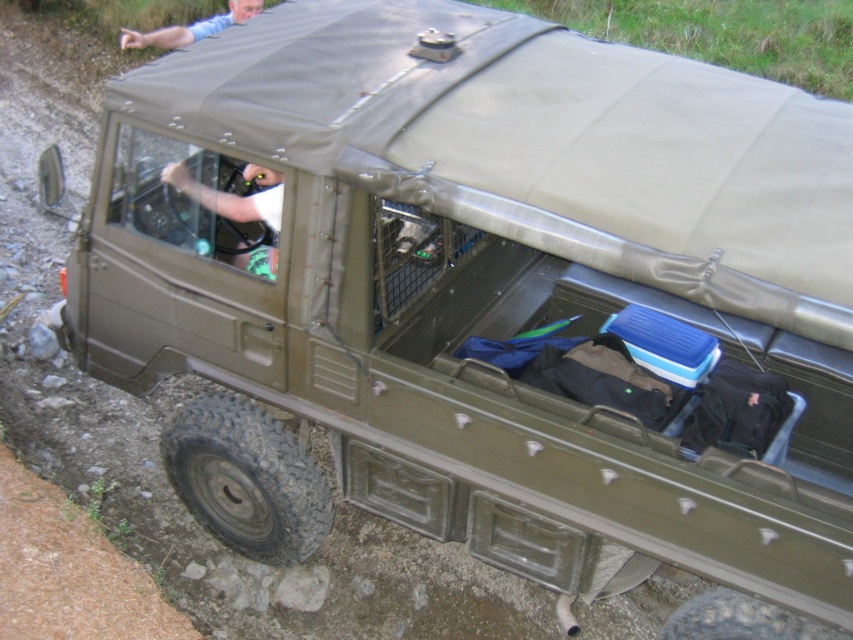
Question: Is white fabric shirt at center smaller than blue denim jeans at upper center?

Choices:
 (A) no
 (B) yes

Answer: (A)

Question: Among these points, which one is nearest to the camera?

Choices:
 (A) (250, 204)
 (B) (195, 33)

Answer: (A)

Question: Does white fabric shirt at center have a lesser width compared to blue denim jeans at upper center?

Choices:
 (A) no
 (B) yes

Answer: (B)

Question: Which point is farther from the camera taking this photo?

Choices:
 (A) (250, 200)
 (B) (131, 32)

Answer: (B)

Question: Among these objects, which one is nearest to the camera?

Choices:
 (A) white fabric shirt at center
 (B) blue denim jeans at upper center

Answer: (A)

Question: Is white fabric shirt at center further to the viewer compared to blue denim jeans at upper center?

Choices:
 (A) no
 (B) yes

Answer: (A)